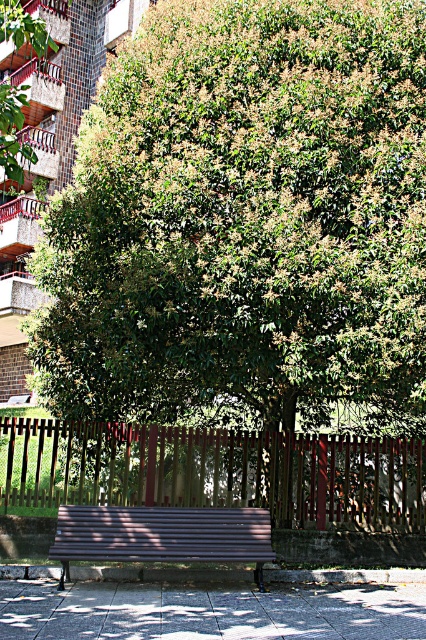
Question: Among these points, which one is nearest to the camera?

Choices:
 (A) (112, 561)
 (B) (86, 468)

Answer: (A)

Question: Does brown wooden fence at center appear under smooth concrete pavement at center?

Choices:
 (A) yes
 (B) no

Answer: (B)

Question: Among these objects, which one is farthest from the camera?

Choices:
 (A) brown wooden fence at center
 (B) brown wooden bench at center

Answer: (A)

Question: Does brown wooden fence at center appear over brown wooden bench at center?

Choices:
 (A) no
 (B) yes

Answer: (B)

Question: Is brown wooden fence at center below smooth concrete pavement at center?

Choices:
 (A) no
 (B) yes

Answer: (A)

Question: Which point appears farthest from the camera in this image?

Choices:
 (A) (229, 540)
 (B) (307, 433)
 (C) (319, 589)

Answer: (B)